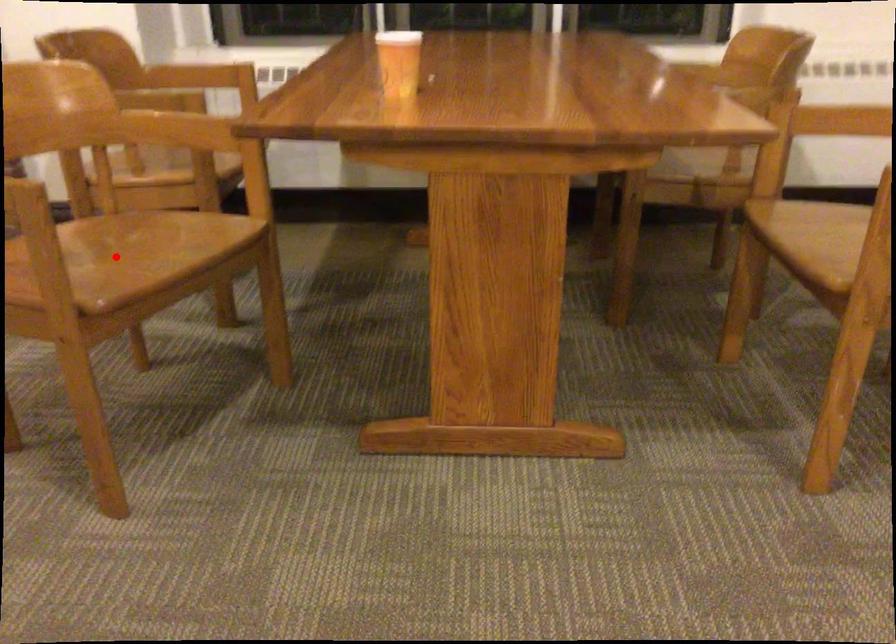
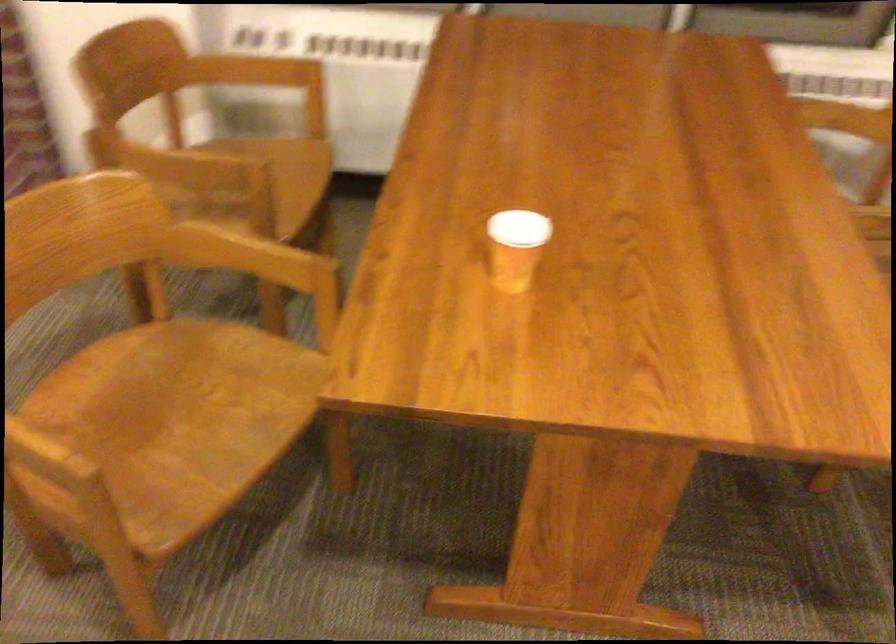
Where in the second image is the point corresponding to the highlighted location from the first image?

(170, 424)